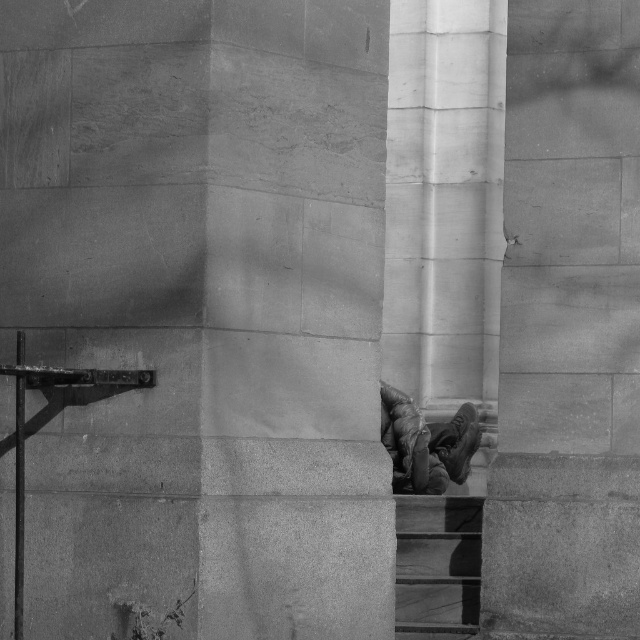
Question: Is smooth concrete stairs at lower right closer to the viewer compared to leather boots at center?

Choices:
 (A) yes
 (B) no

Answer: (A)

Question: Considering the real-world distances, which object is closest to the smooth stone pillar at center?

Choices:
 (A) leather boots at center
 (B) smooth concrete stairs at lower right

Answer: (B)

Question: Is smooth concrete stairs at lower right to the right of leather boots at center from the viewer's perspective?

Choices:
 (A) yes
 (B) no

Answer: (B)

Question: Which point is farther to the camera?

Choices:
 (A) smooth concrete stairs at lower right
 (B) smooth stone pillar at center

Answer: (A)

Question: Which point appears farthest from the camera in this image?

Choices:
 (A) (420, 440)
 (B) (406, 499)
 (C) (42, 90)

Answer: (A)

Question: Does smooth stone pillar at center have a smaller size compared to smooth concrete stairs at lower right?

Choices:
 (A) yes
 (B) no

Answer: (B)